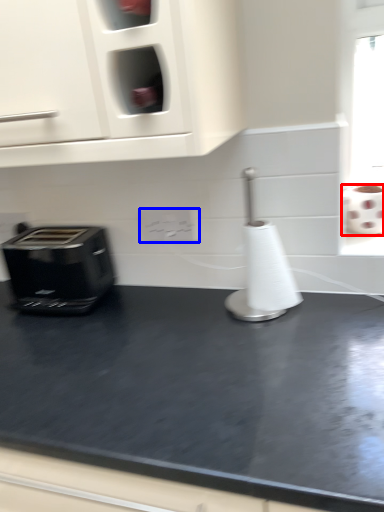
Question: Which object appears farthest to the camera in this image, toilet paper (highlighted by a red box) or electric outlet (highlighted by a blue box)?

Choices:
 (A) toilet paper
 (B) electric outlet

Answer: (B)